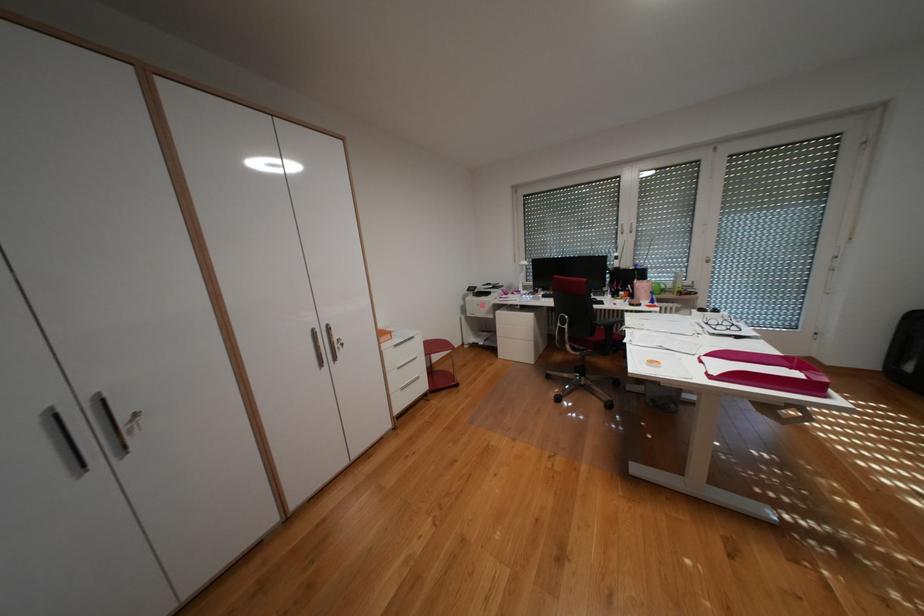
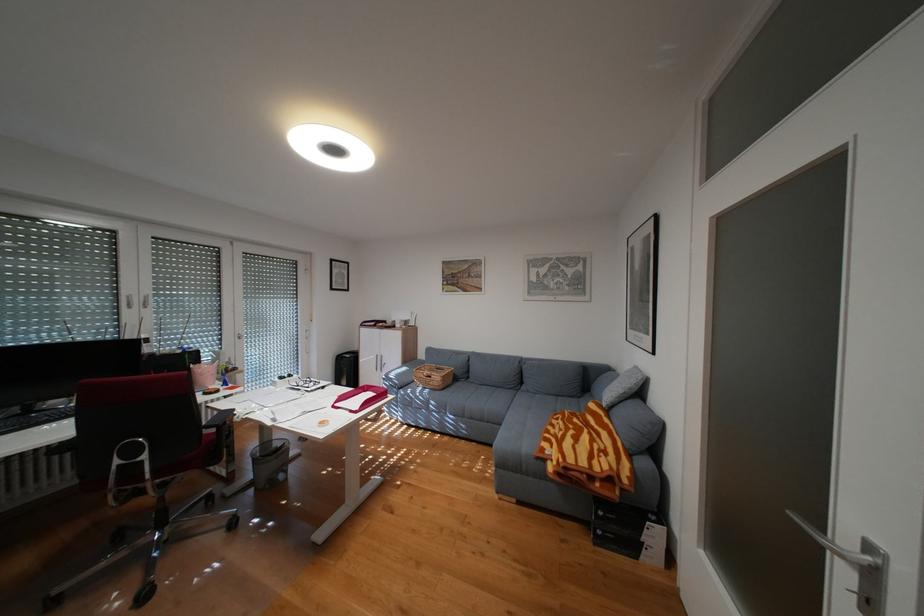
Where in the second image is the point corresponding to point (718, 310) from the first image?

(297, 377)